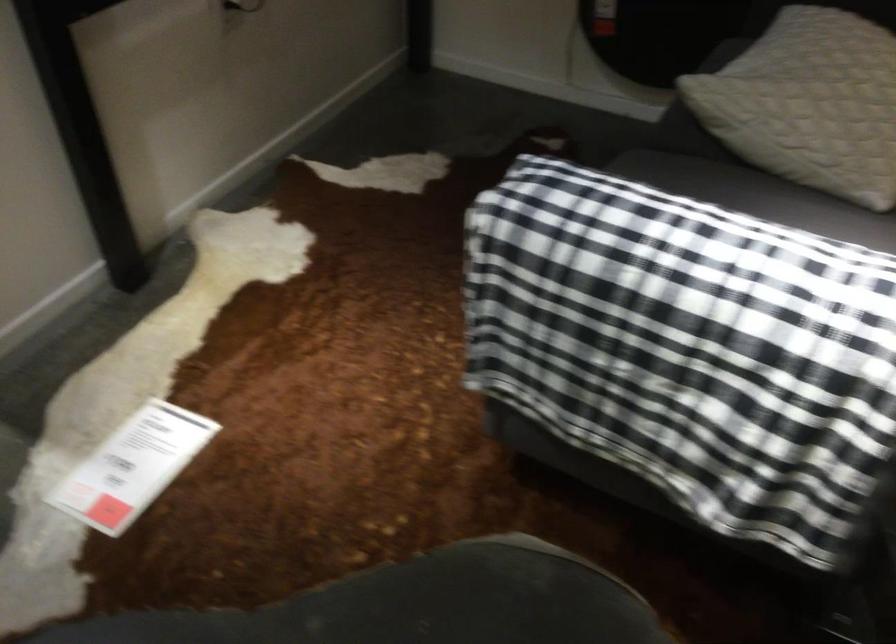
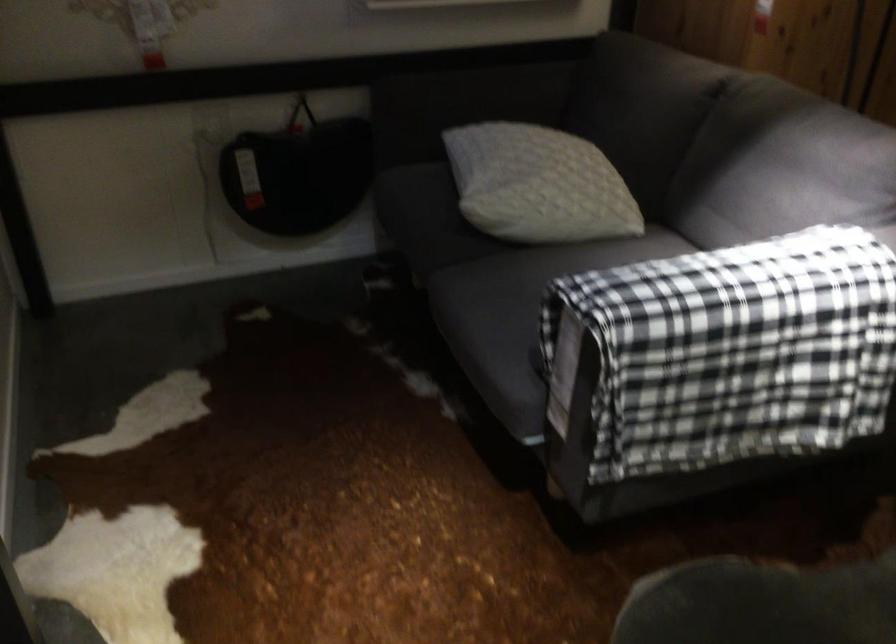
Locate, in the second image, the point that corresponds to point 638,384 in the first image.

(745, 388)